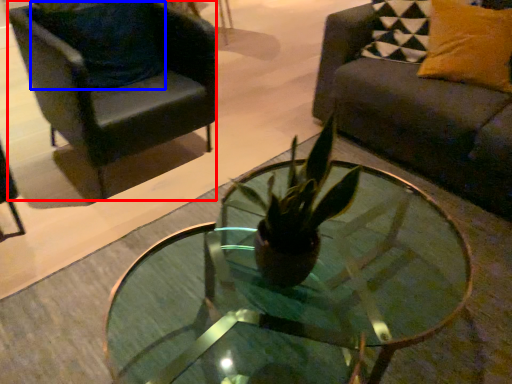
Question: Which object appears farthest to the camera in this image, chair (highlighted by a red box) or pillow (highlighted by a blue box)?

Choices:
 (A) chair
 (B) pillow

Answer: (B)